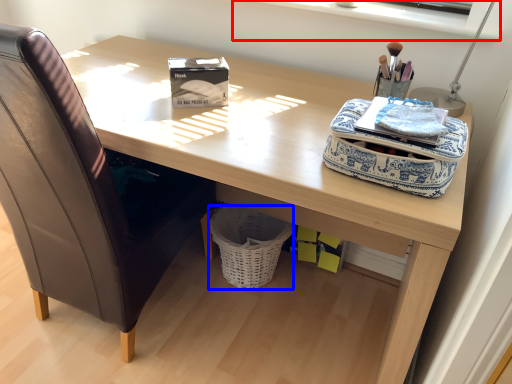
Question: Which of the following is the closest to the observer, window sill (highlighted by a red box) or basket (highlighted by a blue box)?

Choices:
 (A) window sill
 (B) basket

Answer: (A)